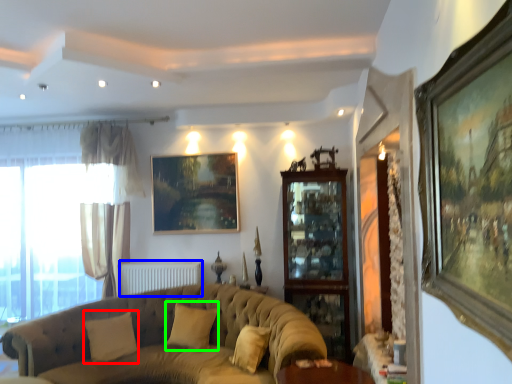
Question: Considering the real-world distances, which object is farthest from pillow (highlighted by a red box)? radiator (highlighted by a blue box) or pillow (highlighted by a green box)?

Choices:
 (A) radiator
 (B) pillow

Answer: (A)